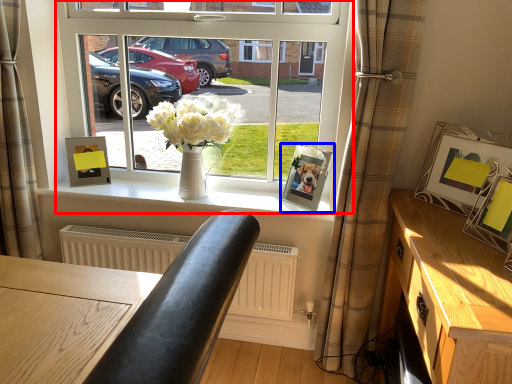
Question: Which of the following is the closest to the observer, window (highlighted by a red box) or picture frame (highlighted by a blue box)?

Choices:
 (A) window
 (B) picture frame

Answer: (A)